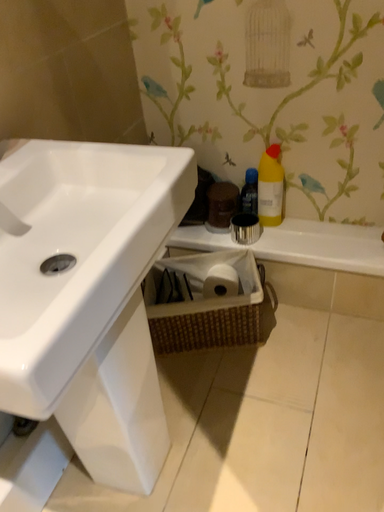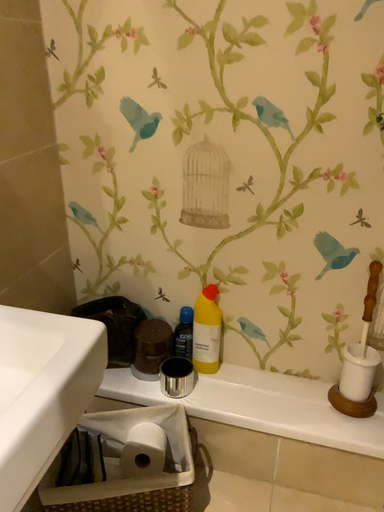
Question: How did the camera likely rotate when shooting the video?

Choices:
 (A) rotated right
 (B) rotated left

Answer: (A)